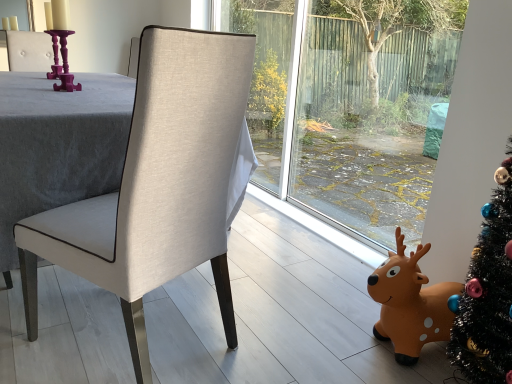
Question: Should I look upward or downward to see purple glossy candle holder at upper left?

Choices:
 (A) up
 (B) down

Answer: (A)

Question: Is purple glossy candle holder at upper left with orange rubber reindeer at lower right?

Choices:
 (A) no
 (B) yes

Answer: (A)

Question: Is purple glossy candle holder at upper left bigger than orange rubber reindeer at lower right?

Choices:
 (A) yes
 (B) no

Answer: (B)

Question: Is purple glossy candle holder at upper left taller than orange rubber reindeer at lower right?

Choices:
 (A) yes
 (B) no

Answer: (B)

Question: Are purple glossy candle holder at upper left and orange rubber reindeer at lower right far apart?

Choices:
 (A) yes
 (B) no

Answer: (A)

Question: Is orange rubber reindeer at lower right a part of purple glossy candle holder at upper left?

Choices:
 (A) yes
 (B) no

Answer: (B)

Question: Could you tell me if purple glossy candle holder at upper left is facing orange rubber reindeer at lower right?

Choices:
 (A) yes
 (B) no

Answer: (B)

Question: Is matte beige fabric chair at center thinner than orange rubber reindeer at lower right?

Choices:
 (A) yes
 (B) no

Answer: (B)

Question: Is matte beige fabric chair at center to the right of orange rubber reindeer at lower right from the viewer's perspective?

Choices:
 (A) yes
 (B) no

Answer: (B)

Question: Does matte beige fabric chair at center have a greater width compared to orange rubber reindeer at lower right?

Choices:
 (A) no
 (B) yes

Answer: (B)

Question: Considering the relative sizes of matte beige fabric chair at center and orange rubber reindeer at lower right in the image provided, is matte beige fabric chair at center smaller than orange rubber reindeer at lower right?

Choices:
 (A) no
 (B) yes

Answer: (A)

Question: Is matte beige fabric chair at center at the left side of orange rubber reindeer at lower right?

Choices:
 (A) no
 (B) yes

Answer: (B)

Question: Is matte beige fabric chair at center positioned in front of orange rubber reindeer at lower right?

Choices:
 (A) yes
 (B) no

Answer: (A)

Question: Considering the relative sizes of purple glossy candle holder at upper left and matte beige fabric chair at center in the image provided, is purple glossy candle holder at upper left shorter than matte beige fabric chair at center?

Choices:
 (A) no
 (B) yes

Answer: (B)